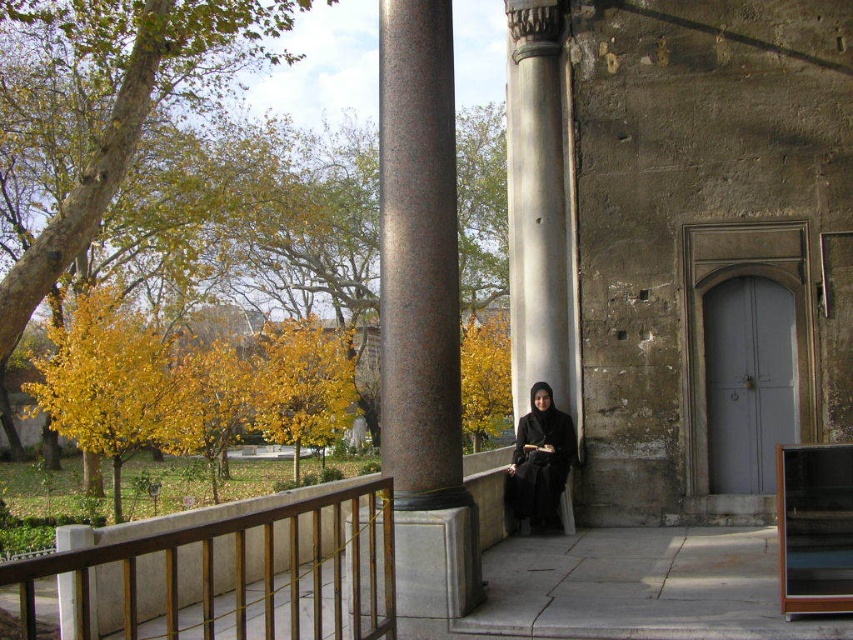
You are standing in front of a historical building and see the polished granite column at center and the black matte dress at center. Which object is positioned to the left?

The polished granite column at center is to the left of the black matte dress at center.